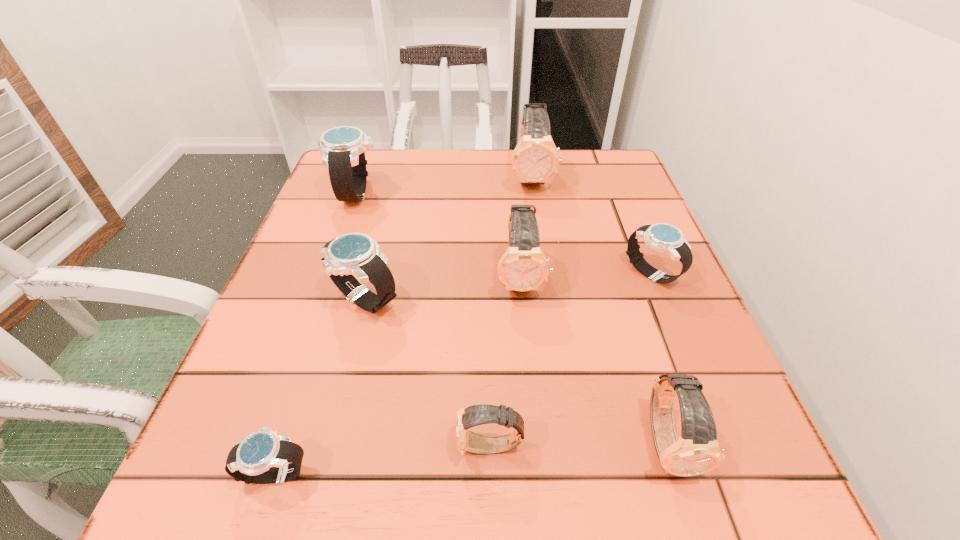
At what (x,y) coordinates should I click in order to perform the action: click on the fourth closest gold watch to the second biggest silver watch. Please return your answer as a coordinate pair (x, y). This screenshot has height=540, width=960. Looking at the image, I should click on (697, 451).

The height and width of the screenshot is (540, 960). I want to click on the closest gold watch to the third biggest gold watch, so click(x=466, y=441).

The width and height of the screenshot is (960, 540). In order to click on silver watch that is the third closest to the smallest gold watch in this screenshot , I will do `click(665, 238)`.

Locate an element on the screen. the closest silver watch to the third biggest silver watch is located at coordinates (351, 259).

In order to click on free space that satisfies the following two spatial constraints: 1. on the face of the tallest object; 2. on the face of the smallest gold watch in this screenshot , I will do `click(573, 447)`.

Image resolution: width=960 pixels, height=540 pixels. What are the coordinates of `vacant space that satisfies the following two spatial constraints: 1. on the back side of the rightmost silver watch; 2. on the right side of the shortest watch` in the screenshot? It's located at (341, 274).

At what (x,y) coordinates should I click in order to perform the action: click on vacant space that satisfies the following two spatial constraints: 1. on the face of the third biggest gold watch; 2. on the face of the smallest gold watch. Please return your answer as a coordinate pair (x, y). Looking at the image, I should click on (669, 447).